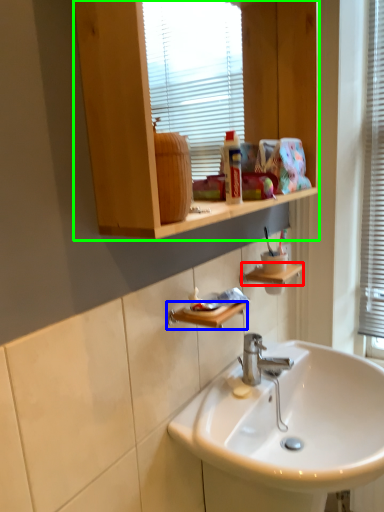
Question: Considering the real-world distances, which object is closest to shelf (highlighted by a red box)? shelf (highlighted by a blue box) or cabinetry (highlighted by a green box).

Choices:
 (A) shelf
 (B) cabinetry

Answer: (A)